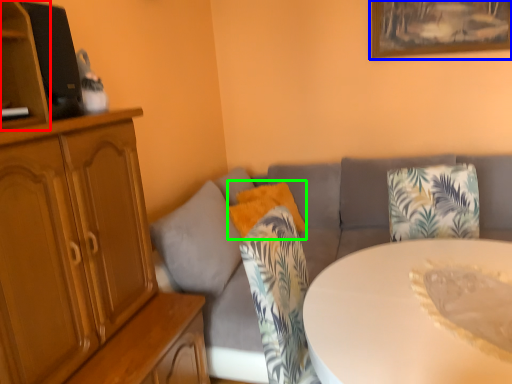
Question: Which object is the closest to the shelf (highlighted by a red box)? Choose among these: picture frame (highlighted by a blue box) or pillow (highlighted by a green box).

Choices:
 (A) picture frame
 (B) pillow

Answer: (B)